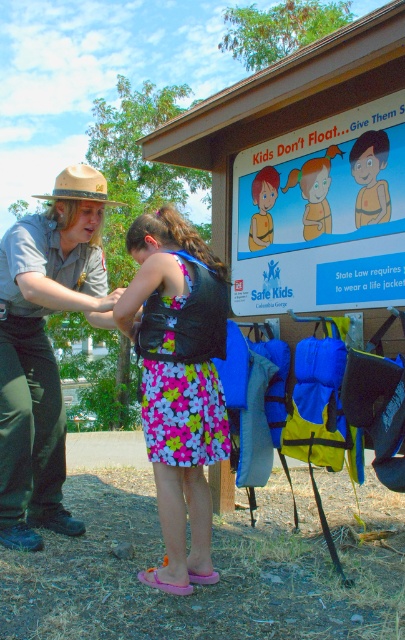
How far apart are blue plastic sign at upper center and matte yellow life jacket at center?

blue plastic sign at upper center and matte yellow life jacket at center are 31.54 centimeters apart.

Identify the location of blue plastic sign at upper center. (321, 214).

You are a GUI agent. You are given a task and a screenshot of the screen. Output one action in this format:
    pyautogui.click(x=<x>, y=<y>)
    Task: Click on the blue plastic sign at upper center
    Image resolution: width=405 pixels, height=640 pixels.
    Given the screenshot: What is the action you would take?
    pyautogui.click(x=321, y=214)

Is floral fabric dress at center bigger than matte brown leather glove at upper left?

Yes.

Can you confirm if floral fabric dress at center is smaller than matte brown leather glove at upper left?

No.

Between point (213, 262) and point (112, 301), which one is positioned in front?

Point (213, 262) is more forward.

Find the location of a particular element. floral fabric dress at center is located at coordinates (179, 381).

Measure the distance from khaki uniform at center to matte brown leather glove at upper left.

khaki uniform at center is 28.41 inches from matte brown leather glove at upper left.

Who is lower down, khaki uniform at center or matte brown leather glove at upper left?

khaki uniform at center

Between point (34, 324) and point (100, 308), which one is positioned in front?

Positioned in front is point (100, 308).

Where is `khaki uniform at center`? Image resolution: width=405 pixels, height=640 pixels. khaki uniform at center is located at coordinates (44, 348).